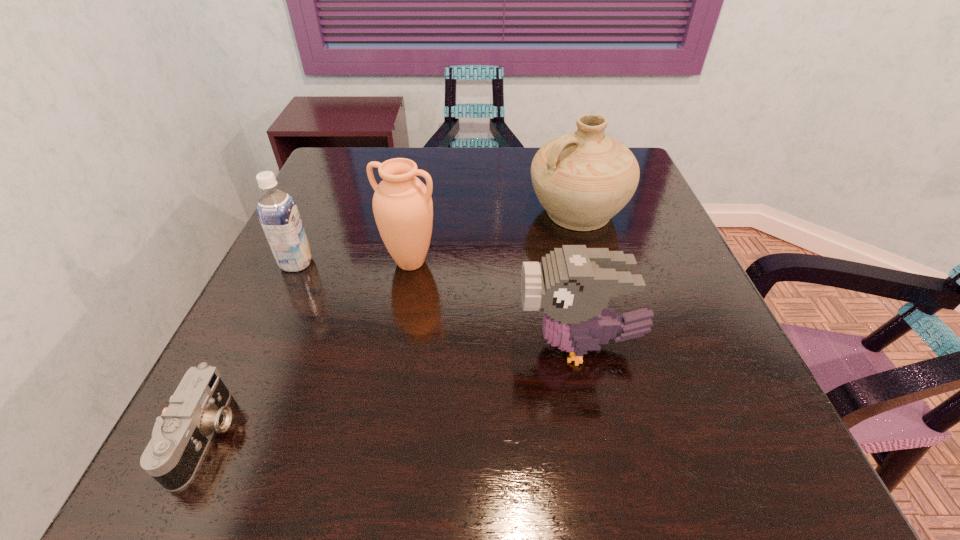
Identify the location of pottery. The height and width of the screenshot is (540, 960). [x=582, y=179].

You are a GUI agent. You are given a task and a screenshot of the screen. Output one action in this format:
    pyautogui.click(x=<x>, y=<y>)
    Task: Click on the urn
    The height and width of the screenshot is (540, 960).
    Given the screenshot: What is the action you would take?
    pyautogui.click(x=402, y=205)

Image resolution: width=960 pixels, height=540 pixels. In order to click on soya milk in this screenshot , I will do `click(277, 211)`.

I want to click on bird, so click(x=573, y=284).

This screenshot has height=540, width=960. Find the location of `the nearest object`. the nearest object is located at coordinates (180, 437).

Locate an element on the screen. The width and height of the screenshot is (960, 540). camera is located at coordinates (180, 437).

Locate an element on the screen. This screenshot has width=960, height=540. free location located 0.110m on the back of the pottery is located at coordinates (564, 167).

The image size is (960, 540). What are the coordinates of `free location located on the right of the third object from left to right` in the screenshot? It's located at (471, 262).

Where is `vacant space positioned on the label of the soya milk`? vacant space positioned on the label of the soya milk is located at coordinates (464, 263).

Identify the location of vacant space located 0.160m at the beak of the fourth farthest object. (431, 346).